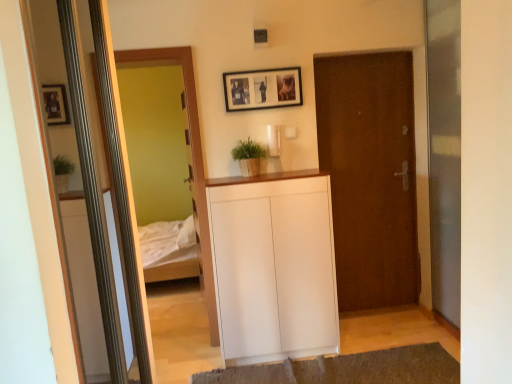
Locate an element on the screen. The width and height of the screenshot is (512, 384). free location to the right of white matte cabinet at center is located at coordinates (369, 334).